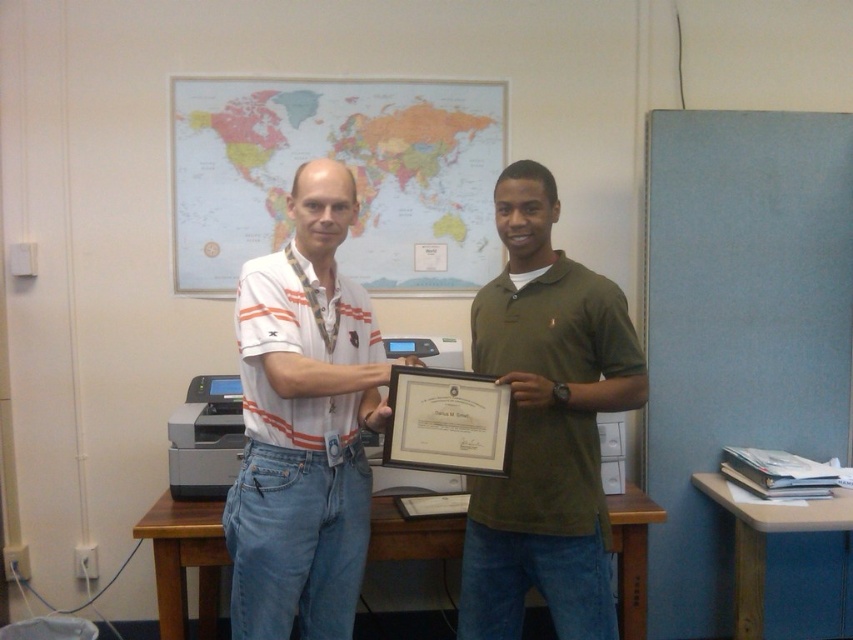
Between white striped polo shirt at center and green matte shirt at center, which one is positioned higher?

white striped polo shirt at center is above.

Is point (320, 557) closer to viewer compared to point (520, 582)?

Yes.

Which is in front, point (283, 326) or point (496, 278)?

Positioned in front is point (283, 326).

Image resolution: width=853 pixels, height=640 pixels. Find the location of `white striped polo shirt at center`. white striped polo shirt at center is located at coordinates (305, 422).